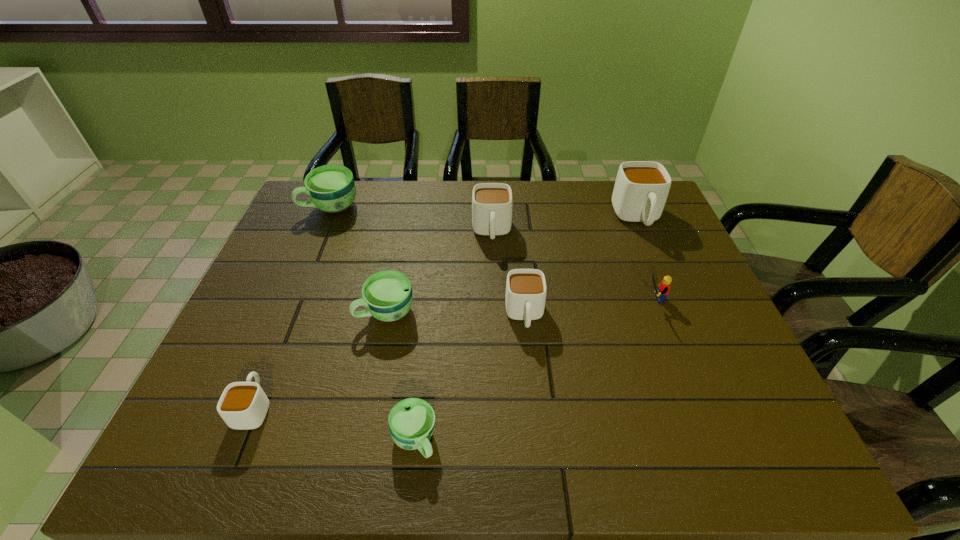
You are a GUI agent. You are given a task and a screenshot of the screen. Output one action in this format:
    pyautogui.click(x=<x>, y=<y>)
    Task: Click on the free point between the third farthest white cup and the Lego
    
    Given the screenshot: What is the action you would take?
    pyautogui.click(x=588, y=307)

The height and width of the screenshot is (540, 960). Find the location of `blank region between the third smallest white cup and the smallest white cup`. blank region between the third smallest white cup and the smallest white cup is located at coordinates (372, 320).

You are a GUI agent. You are given a task and a screenshot of the screen. Output one action in this format:
    pyautogui.click(x=<x>, y=<y>)
    Task: Click on the unoccupied position between the third farthest white cup and the biggest white cup
    The width and height of the screenshot is (960, 540).
    Given the screenshot: What is the action you would take?
    pyautogui.click(x=581, y=267)

Identify the location of object identified as the fourth closest to the farthest blue cup. Image resolution: width=960 pixels, height=540 pixels. (243, 405).

Locate an element on the screen. This screenshot has height=540, width=960. object that is the fifth closest to the yellow Lego is located at coordinates (411, 421).

Identify which cup is the second nearest to the third smallest white cup. Please provide its 2D coordinates. Your answer should be formatted as a tuple, i.e. [(x, y)], where the tuple contains the x and y coordinates of a point satisfying the conditions above.

[(387, 294)]

Where is `the fourth closest cup to the second biggest white cup`? The height and width of the screenshot is (540, 960). the fourth closest cup to the second biggest white cup is located at coordinates pyautogui.click(x=331, y=188).

The width and height of the screenshot is (960, 540). I want to click on the third closest white cup relative to the yellow Lego, so pyautogui.click(x=491, y=202).

Image resolution: width=960 pixels, height=540 pixels. What are the coordinates of `white cup that stands as the second closest to the rightmost cup` in the screenshot? It's located at (525, 297).

You are a GUI agent. You are given a task and a screenshot of the screen. Output one action in this format:
    pyautogui.click(x=<x>, y=<y>)
    Task: Click on the blue cup that is the second closest one to the nearest blue cup
    This screenshot has width=960, height=540.
    Given the screenshot: What is the action you would take?
    pyautogui.click(x=331, y=188)